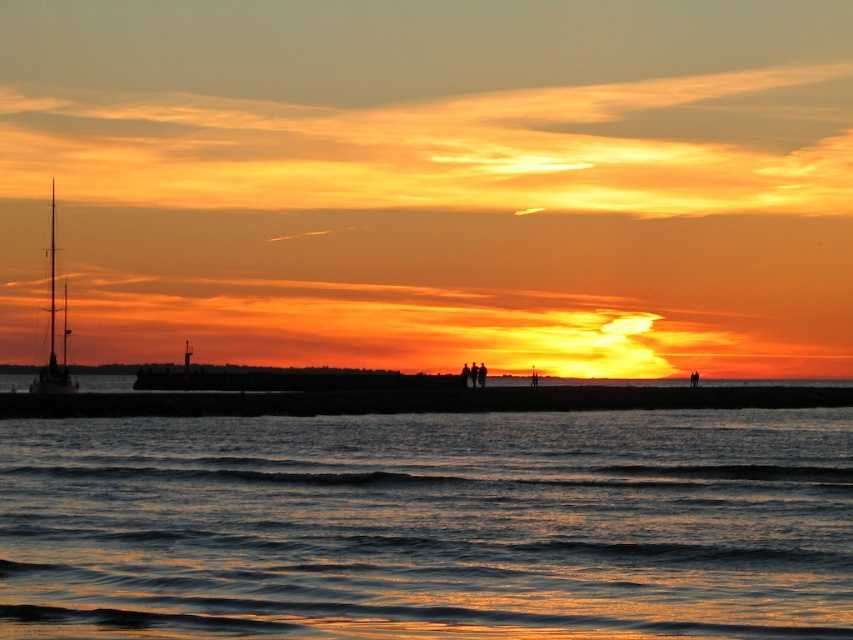
Question: Which object appears farthest from the camera in this image?

Choices:
 (A) shiny metallic sailboat at left
 (B) shiny metallic water at lower center

Answer: (A)

Question: Which point is closer to the camera?

Choices:
 (A) shiny metallic sailboat at left
 (B) shiny metallic water at lower center

Answer: (B)

Question: Does shiny metallic water at lower center have a lesser width compared to shiny metallic sailboat at left?

Choices:
 (A) no
 (B) yes

Answer: (B)

Question: Is shiny metallic water at lower center wider than shiny metallic sailboat at left?

Choices:
 (A) no
 (B) yes

Answer: (A)

Question: Is shiny metallic water at lower center wider than shiny metallic sailboat at left?

Choices:
 (A) yes
 (B) no

Answer: (B)

Question: Among these objects, which one is farthest from the camera?

Choices:
 (A) shiny metallic sailboat at left
 (B) shiny metallic water at lower center

Answer: (A)